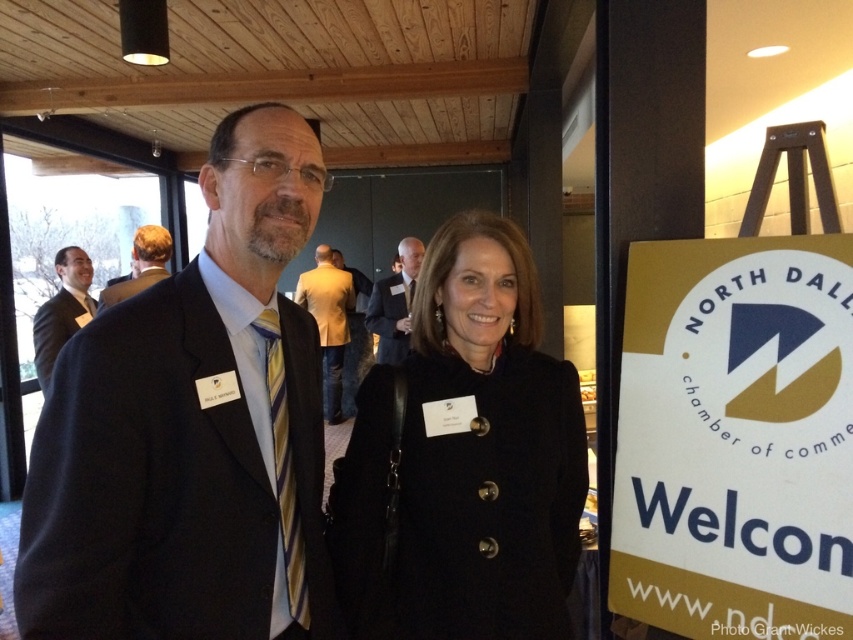
You are attending a professional networking event and need to introduce yourself to both individuals wearing the matte black suit at center and the golden textured blazer at center. Which person should you approach first if you want to greet the shorter individual?

The matte black suit at center has a smaller size compared to golden textured blazer at center, so you should approach the person wearing the matte black suit at center first as they are shorter.